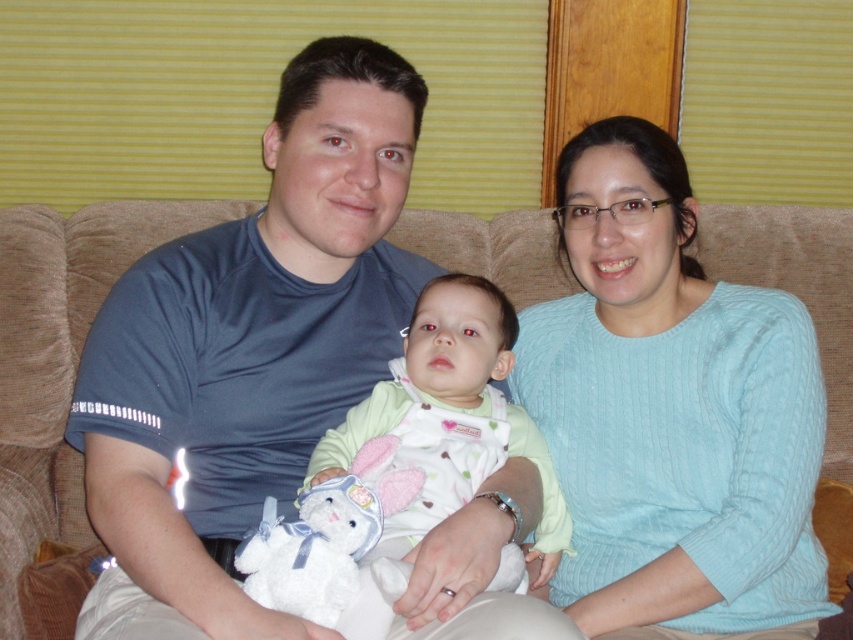
You are a furniture designer evaluating the space requirements for the beige fabric couch at center and the light green fabric baby at center. Based on their sizes, which object would require more space in a room?

The beige fabric couch at center requires more space in the room because it has a larger size compared to the light green fabric baby at center.

You are a photographer setting up for a family photo. You need to position a small prop between the blue cotton shirt at center and the light green fabric baby at center so it is visible to the camera. Where should you place the prop?

The prop should be placed between the blue cotton shirt at center and the light green fabric baby at center, but below the blue cotton shirt at center since it is above the baby, ensuring it is in the camera view.